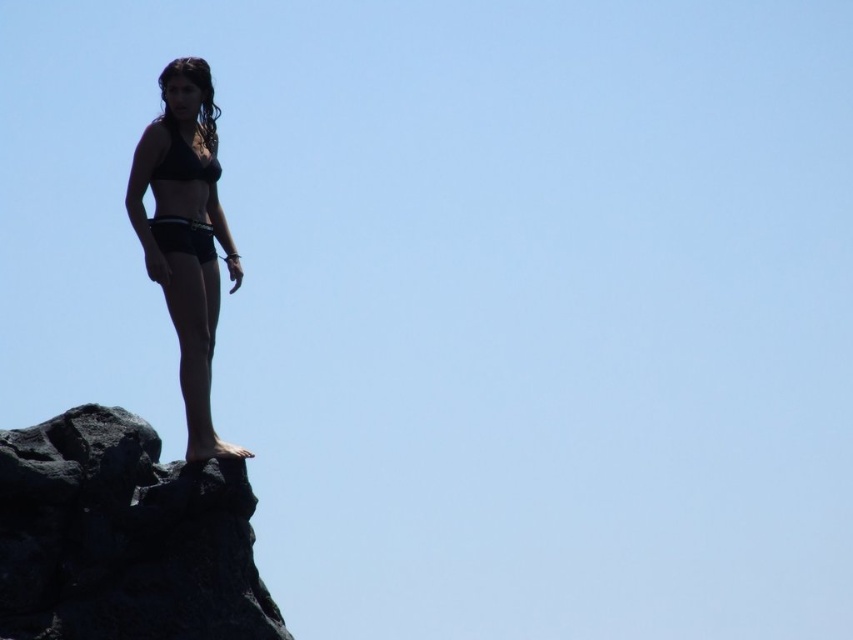
From the picture: You are a photographer trying to capture the silhouette of the person standing on the black rough rock at upper left. If your camera can focus on objects up to 40 meters away, will you be able to clearly photograph the silhouette?

The black rough rock at upper left is 41.13 meters away from camera, which is beyond the camera focus limit of 40 meters. Therefore, the silhouette might not be clearly captured.

You are an artist trying to sketch the scene. You want to place the black rough rock at upper left in your drawing. Where should you position it on a coordinate grid from 0 to 1 in both x and y axes?

The black rough rock at upper left should be positioned at coordinates approximately 0.841 on the x axis and 0.145 on the y axis.